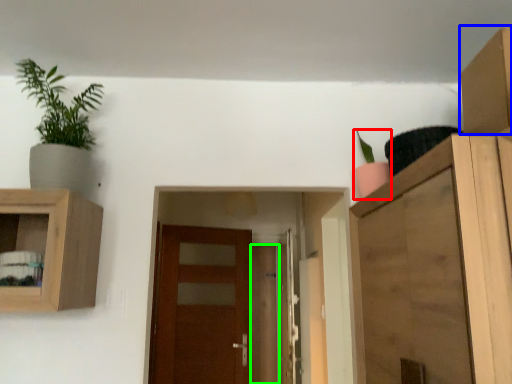
Question: Based on their relative distances, which object is nearer to houseplant (highlighted by a red box)? Choose from cardboard box (highlighted by a blue box) and door (highlighted by a green box).

Choices:
 (A) cardboard box
 (B) door

Answer: (A)